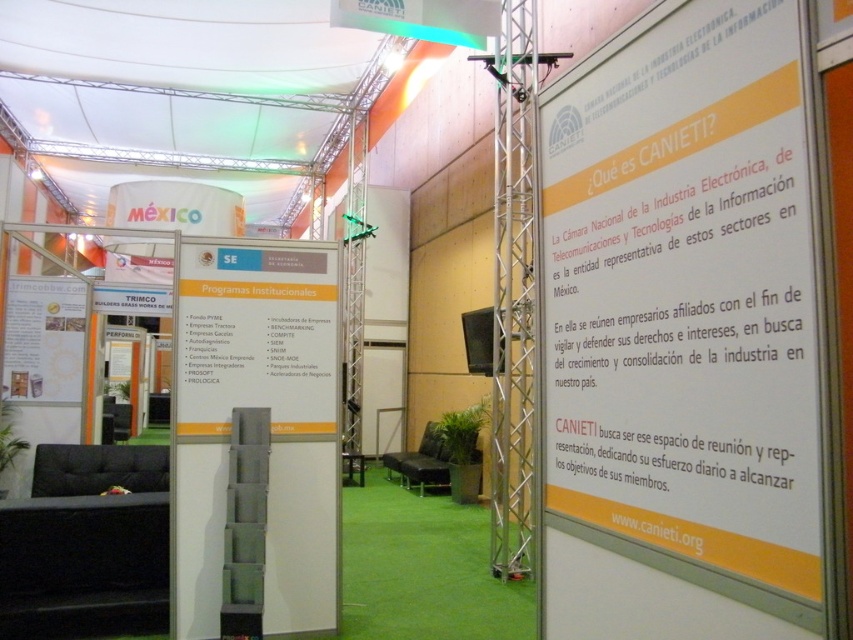
Can you confirm if yellow paperboard sign at right is positioned above white cardboard sign at left?

Yes, yellow paperboard sign at right is above white cardboard sign at left.

Which is in front, point (589, 100) or point (187, 314)?

Point (589, 100) is in front.

You are a GUI agent. You are given a task and a screenshot of the screen. Output one action in this format:
    pyautogui.click(x=<x>, y=<y>)
    Task: Click on the yellow paperboard sign at right
    
    Given the screenshot: What is the action you would take?
    pyautogui.click(x=683, y=332)